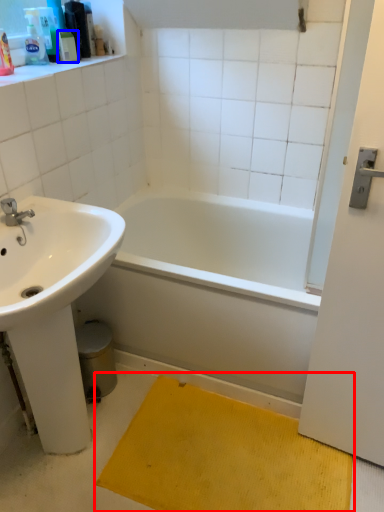
Question: Which point is further to the camera, doormat (highlighted by a red box) or toiletry (highlighted by a blue box)?

Choices:
 (A) doormat
 (B) toiletry

Answer: (B)